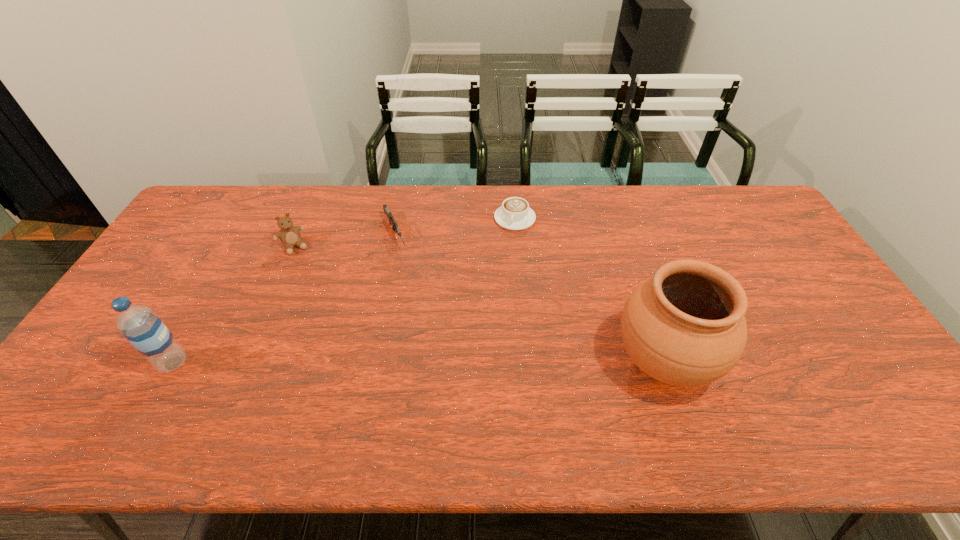
Identify the location of vacant region located with the handle on the right side of the fourth object from left to right. Image resolution: width=960 pixels, height=540 pixels. (509, 254).

At what (x,y) coordinates should I click in order to perform the action: click on free space located 0.110m on the front-facing side of the third tallest object. Please return your answer as a coordinate pair (x, y). The width and height of the screenshot is (960, 540). Looking at the image, I should click on (311, 275).

At what (x,y) coordinates should I click in order to perform the action: click on vacant space situated 0.380m on the front-facing side of the third tallest object. Please return your answer as a coordinate pair (x, y). This screenshot has width=960, height=540. Looking at the image, I should click on (346, 335).

The height and width of the screenshot is (540, 960). What are the coordinates of `free point located 0.050m on the front-facing side of the third tallest object` in the screenshot? It's located at (304, 264).

Identify the location of vacant space located 0.290m aimed along the barrel of the third object from left to right. This screenshot has height=540, width=960. 431,316.

Identify the location of blank space located aimed along the barrel of the third object from left to right. (428, 310).

At what (x,y) coordinates should I click in order to perform the action: click on free point located 0.050m aimed along the barrel of the third object from left to right. Please return your answer as a coordinate pair (x, y). Looking at the image, I should click on (403, 261).

Identify the location of cappuccino positioned at the far edge. (514, 214).

You are a GUI agent. You are given a task and a screenshot of the screen. Output one action in this format:
    pyautogui.click(x=<x>, y=<y>)
    Task: Click on the gun that is positioned at the far edge
    
    Given the screenshot: What is the action you would take?
    click(388, 213)

Find the location of a particular element. Image resolution: width=960 pixels, height=540 pixels. water bottle located at the near edge is located at coordinates (139, 324).